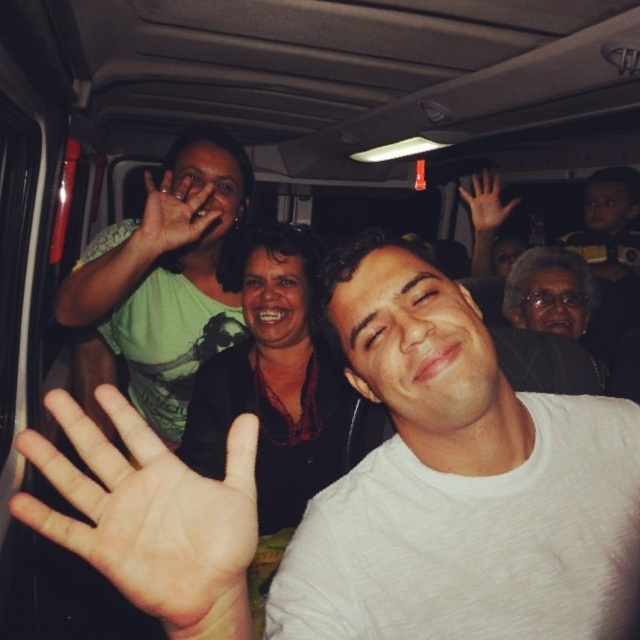
Question: Does white cotton shirt at center appear over brown skin hand at center?

Choices:
 (A) no
 (B) yes

Answer: (A)

Question: Can you confirm if green matte shirt at upper left is wider than matte green hand at upper center?

Choices:
 (A) no
 (B) yes

Answer: (B)

Question: Which object is positioned closest to the white cotton shirt at center?

Choices:
 (A) green matte shirt at upper left
 (B) brown skin hand at upper right

Answer: (A)

Question: Among these points, which one is farthest from the camera?

Choices:
 (A) (500, 618)
 (B) (113, 392)
 (C) (182, 198)
 (D) (474, 195)

Answer: (D)

Question: Which object is positioned closest to the green matte shirt at upper left?

Choices:
 (A) brown skin hand at upper right
 (B) matte green hand at upper center

Answer: (B)

Question: Can you confirm if green matte shirt at upper left is bigger than matte green hand at upper center?

Choices:
 (A) no
 (B) yes

Answer: (B)